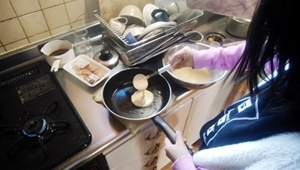
This screenshot has height=170, width=300. Find the location of `glass`. glass is located at coordinates (80, 39).